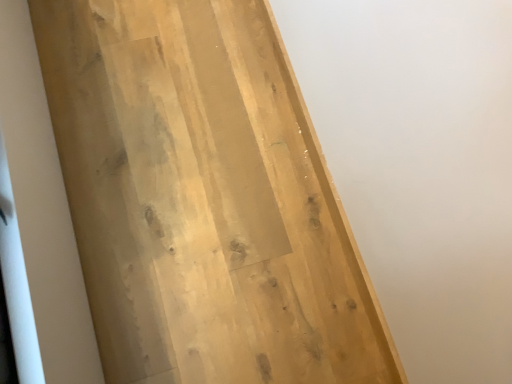
This screenshot has width=512, height=384. I want to click on natural wood door at center, so 204,198.

This screenshot has width=512, height=384. Describe the element at coordinates (204, 198) in the screenshot. I see `natural wood door at center` at that location.

Where is `natural wood door at center`? This screenshot has height=384, width=512. natural wood door at center is located at coordinates (204, 198).